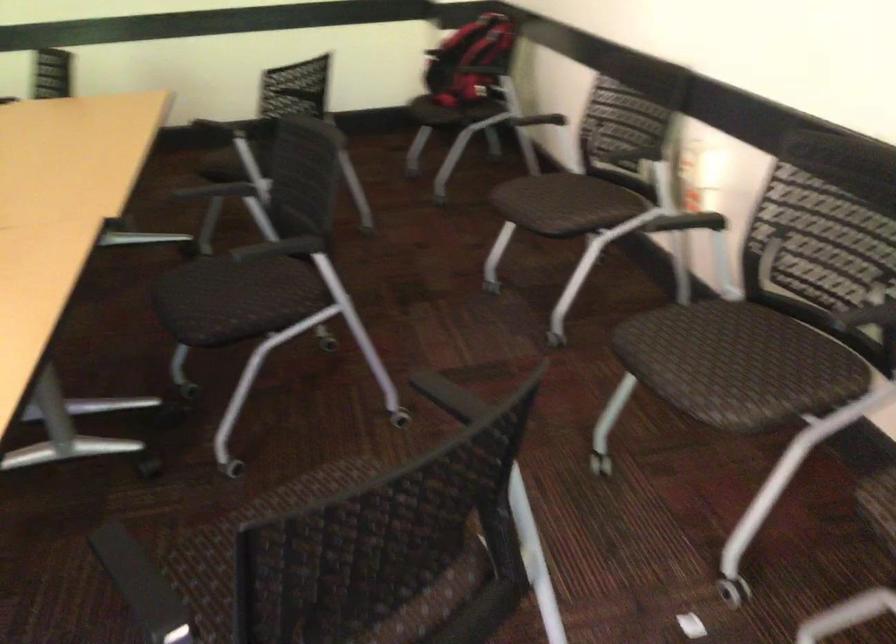
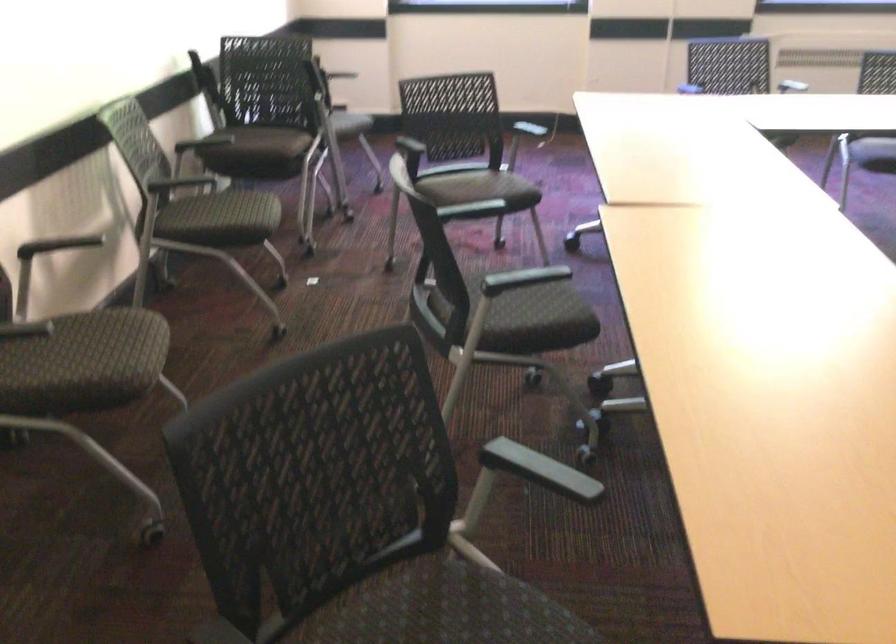
Where in the second image is the point corresponding to (x=217, y=194) from the first image?

(522, 279)